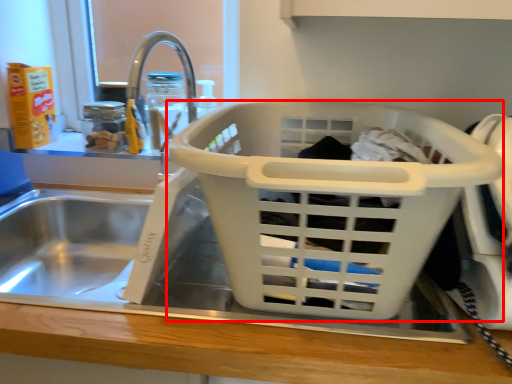
Question: Considering the relative positions of basket (annotated by the red box) and bottle in the image provided, where is basket (annotated by the red box) located with respect to the staircase?

Choices:
 (A) right
 (B) left

Answer: (A)